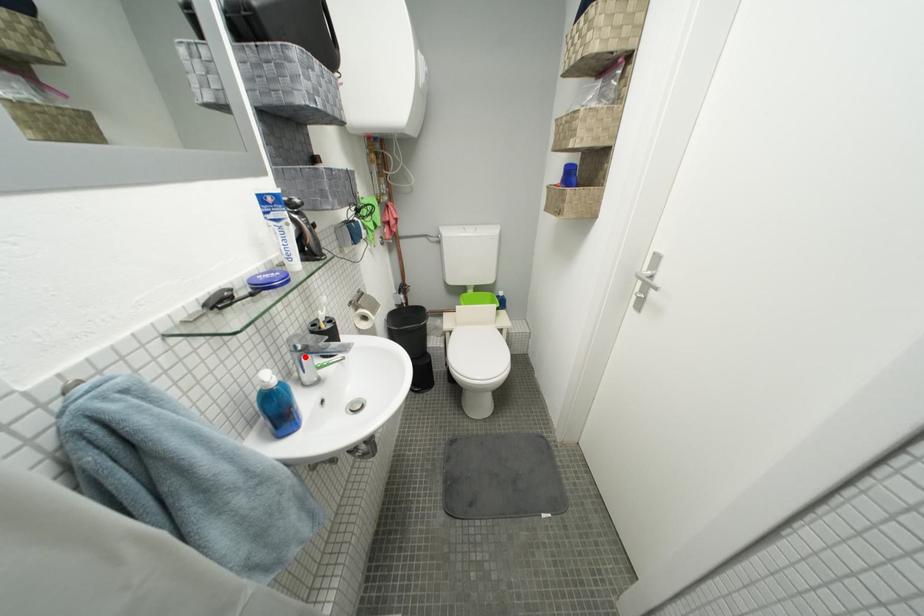
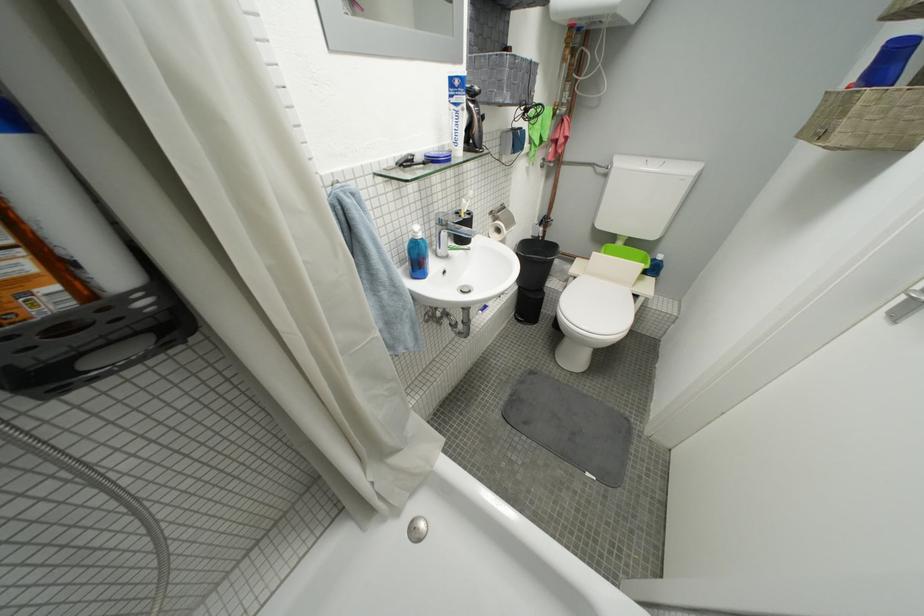
Question: A red point is marked in image1. In image2, is the corresponding 3D point closer to the camera or farther? Reply with the corresponding letter.

Choices:
 (A) The corresponding 3D point is closer.
 (B) The corresponding 3D point is farther.

Answer: (A)